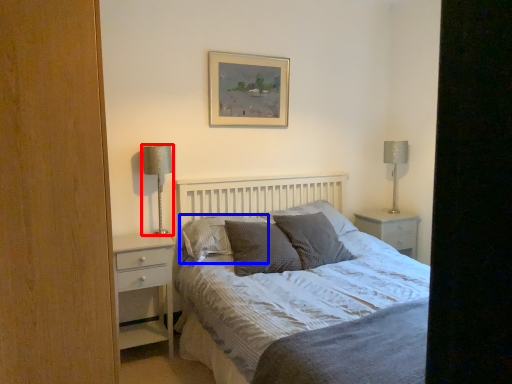
Question: Which object appears farthest to the camera in this image, table lamp (highlighted by a red box) or pillow (highlighted by a blue box)?

Choices:
 (A) table lamp
 (B) pillow

Answer: (A)